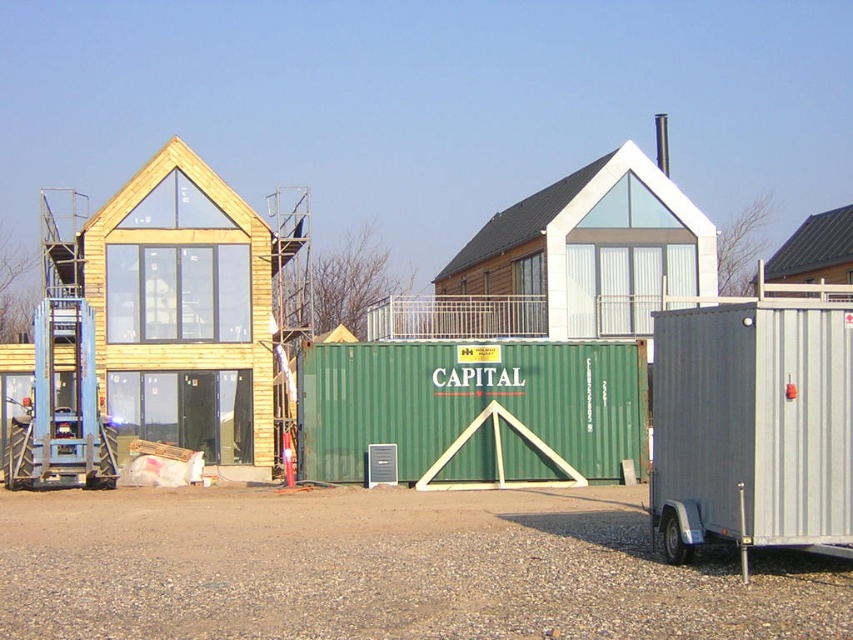
You are a delivery driver who needs to park your vehicle between the gray metallic trailer at right and the brown wooden hut at upper right. Is there enough space between them to park your truck, which is 8 meters long?

The gray metallic trailer at right is to the left of brown wooden hut at upper right, but the distance between them is not specified. Without knowing the exact spacing, it is impossible to determine if there is sufficient room for an 8 meter truck.

You are a delivery driver who needs to park your truck next to the wooden house at left and the gray metallic trailer at right. Which one has a wider space available for parking?

The wooden house at left has a wider space available for parking because its width surpasses that of the gray metallic trailer at right.